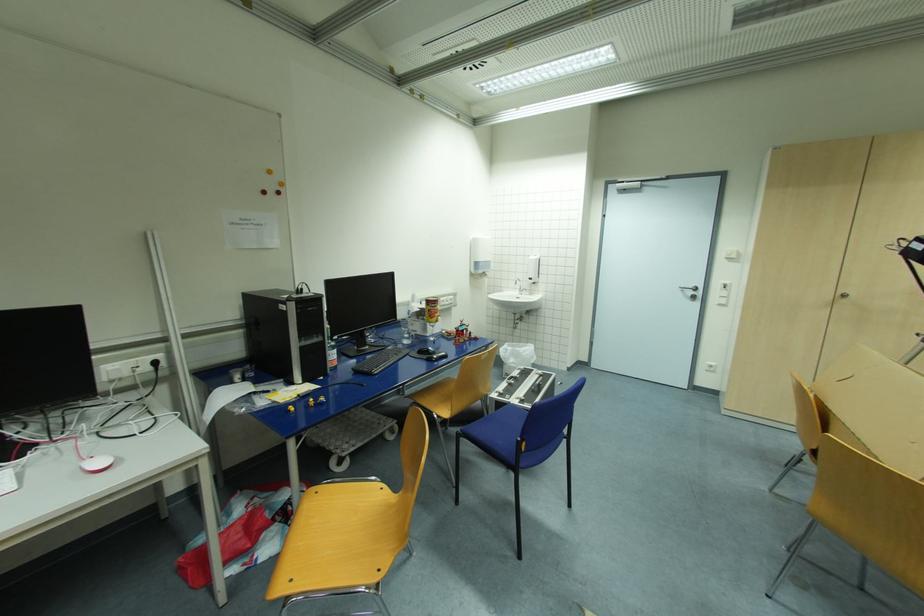
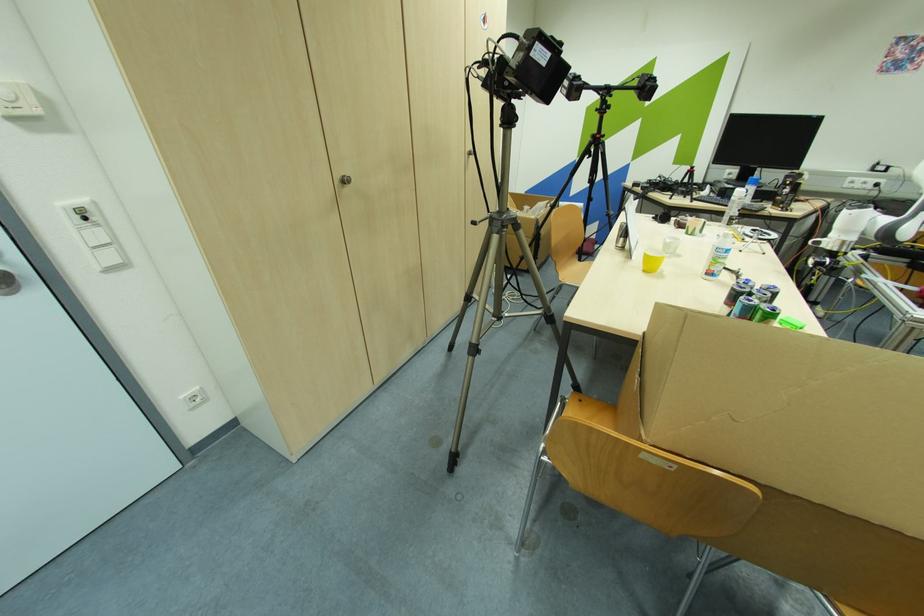
Locate, in the second image, the point that corresponds to [714,367] in the first image.

(198, 399)